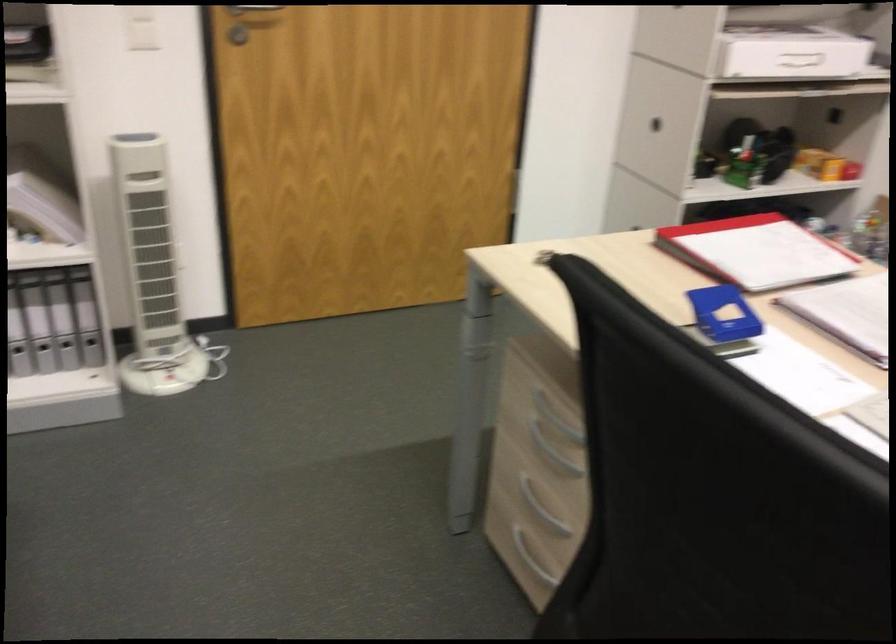
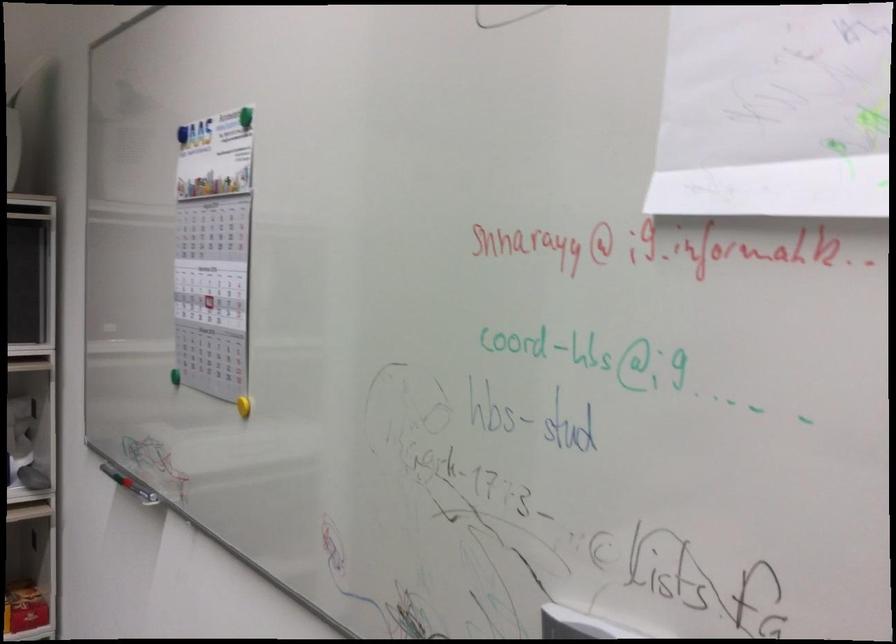
Question: In a continuous first-person perspective shot, in which direction is the camera moving?

Choices:
 (A) Left
 (B) Right
 (C) Forward
 (D) Backward

Answer: (B)